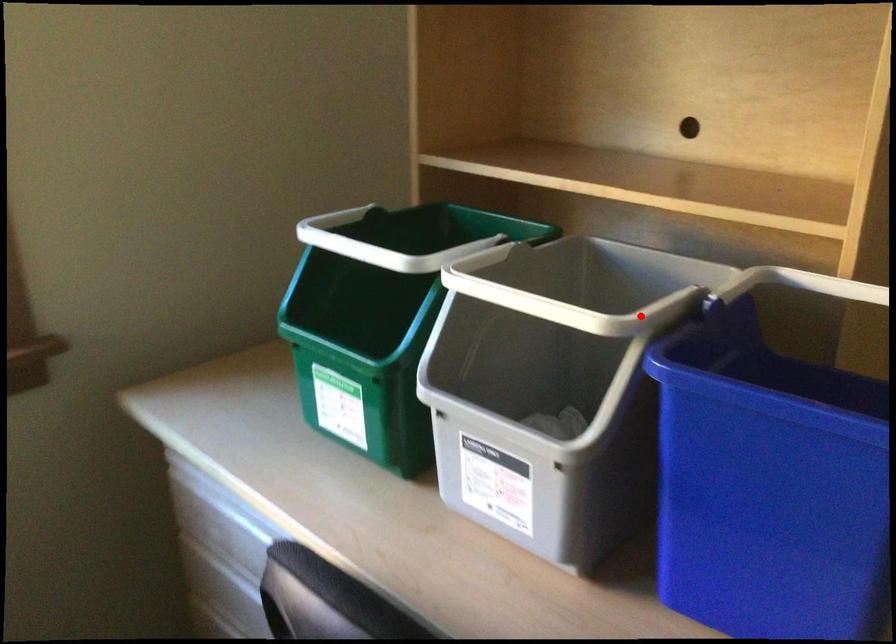
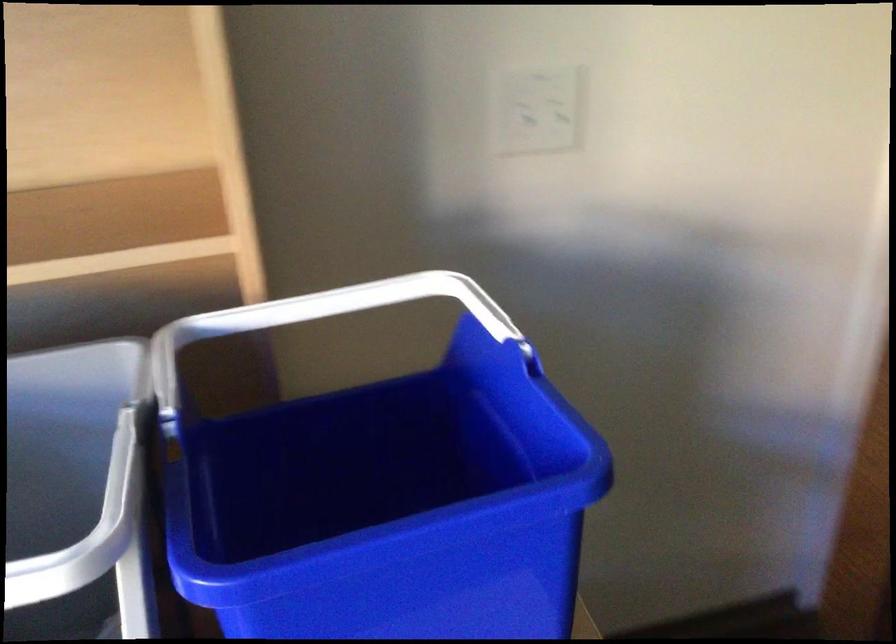
Where in the second image is the point corresponding to the highlighted location from the first image?

(125, 529)